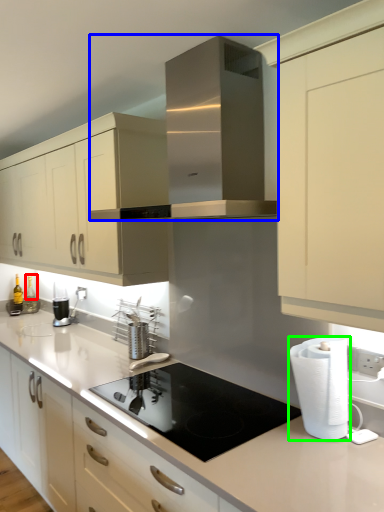
Question: Which object is the closest to the bottle (highlighted by a red box)? Choose among these: home appliance (highlighted by a blue box) or paper towel (highlighted by a green box).

Choices:
 (A) home appliance
 (B) paper towel

Answer: (A)